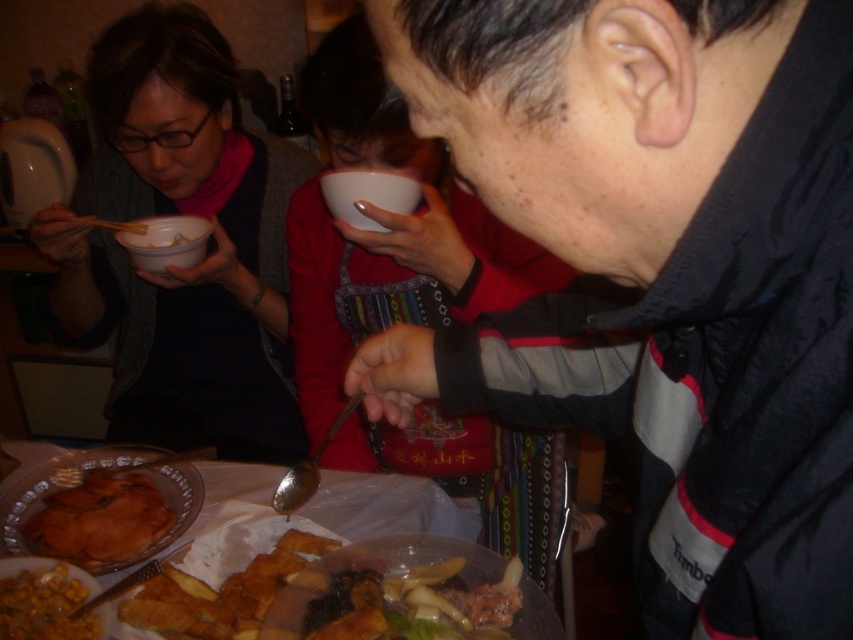
You are a food critic observing the scene. You notice the yellowish matte fried food at lower left and the white matte bowl at upper center. Which object is shorter in height?

The yellowish matte fried food at lower left has a lesser height compared to the white matte bowl at upper center, so the yellowish matte fried food at lower left is shorter in height.

You are a guest at this dinner and want to place your napkin on the table without blocking the white matte bowl at upper center. Given that the black matte jacket at upper right is taller than the bowl, where should you place the napkin?

Since the black matte jacket at upper right is taller than the white matte bowl at upper center, placing the napkin to the side of the bowl or behind it would ensure it doesn

You are a food critic visiting a local diner. You notice the yellowish matte fried food at lower left and the white matte bowl at upper center on the table. Based on their sizes, which one do you think is more suitable for a main course dish?

The white matte bowl at upper center is more suitable for a main course dish because it is larger in size compared to the yellowish matte fried food at lower left.